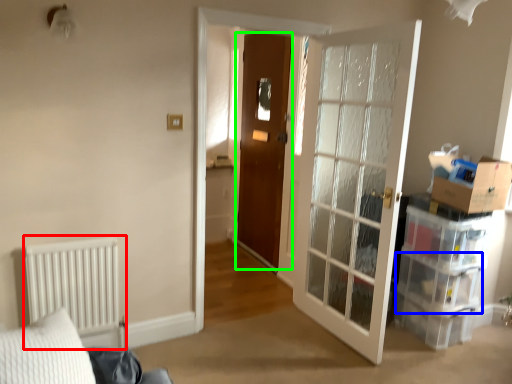
Question: Considering the real-world distances, which object is farthest from radiator (highlighted by a red box)? drawer (highlighted by a blue box) or door (highlighted by a green box)?

Choices:
 (A) drawer
 (B) door

Answer: (A)